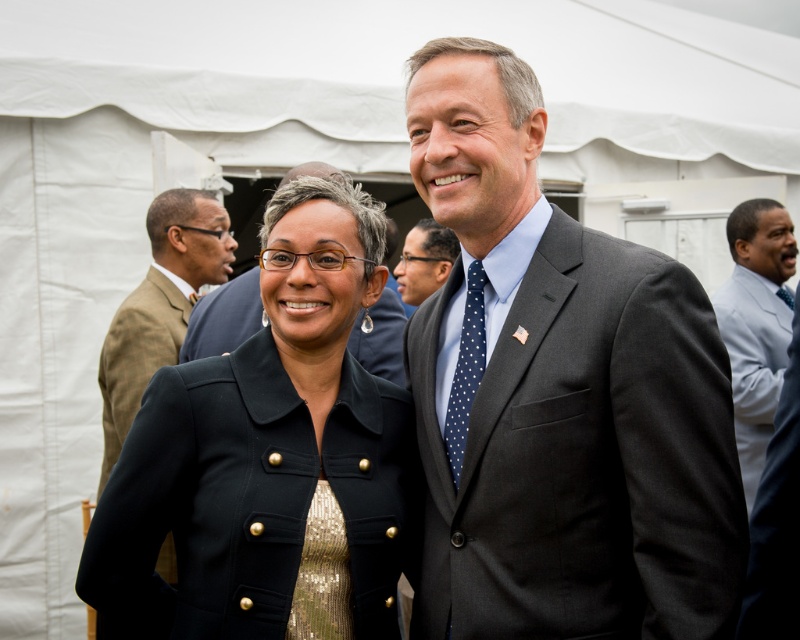
You are a photographer at a formal event. You need to capture a photo of both the black matte jacket at center and the gold sequined dress at center in the same frame. The camera you are using has a minimum focus distance of 1 meter. Can you position yourself so that both objects are in focus without moving the subjects?

The black matte jacket at center is 1.34 meters from the gold sequined dress at center. Since the camera requires a minimum focus distance of 1 meter, you can position yourself within 1 meter from both objects to ensure they are in focus while maintaining the 1.34 meters between them.